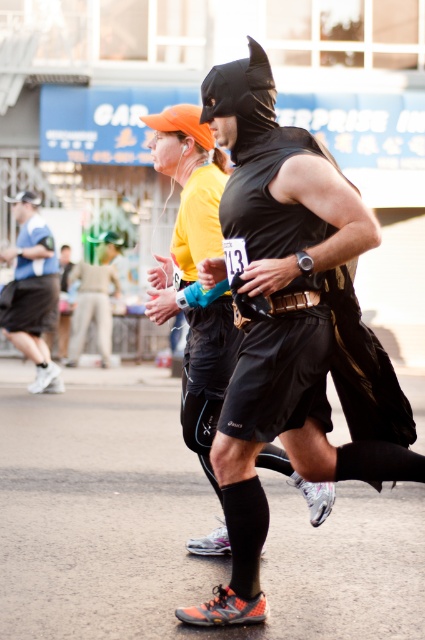
Question: Is black matte vest at center smaller than matte blue shirt at left?

Choices:
 (A) no
 (B) yes

Answer: (B)

Question: Which object appears farthest from the camera in this image?

Choices:
 (A) black matte vest at center
 (B) matte blue shirt at left

Answer: (B)

Question: Does matte black costume at center have a smaller size compared to matte blue shirt at left?

Choices:
 (A) no
 (B) yes

Answer: (B)

Question: Is matte black costume at center thinner than matte blue shirt at left?

Choices:
 (A) no
 (B) yes

Answer: (A)

Question: Which point is farther to the camera?

Choices:
 (A) matte blue shirt at left
 (B) black matte vest at center

Answer: (A)

Question: Which point is closer to the camera?

Choices:
 (A) matte black costume at center
 (B) matte blue shirt at left
 (C) black matte vest at center

Answer: (A)